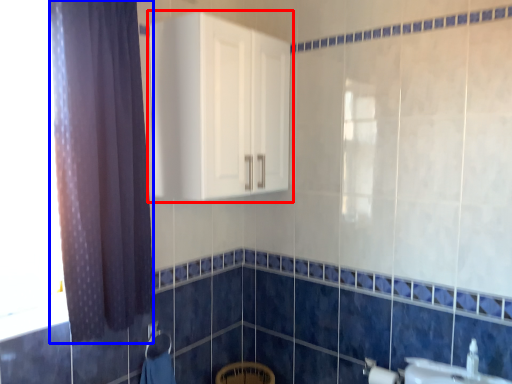
Question: Among these objects, which one is nearest to the camera, cabinetry (highlighted by a red box) or curtain (highlighted by a blue box)?

Choices:
 (A) cabinetry
 (B) curtain

Answer: (B)